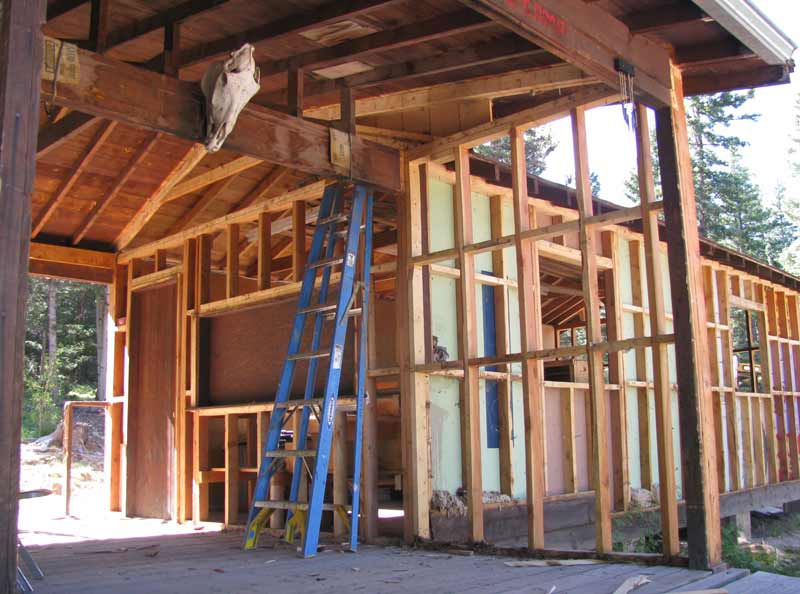
This screenshot has width=800, height=594. What are the coordinates of `door` in the screenshot? It's located at (153, 328).